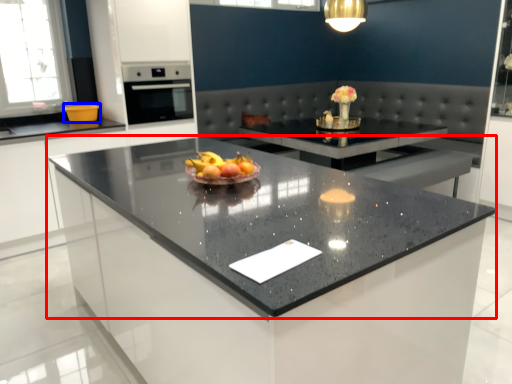
Question: Which object is closer to the camera taking this photo, countertop (highlighted by a red box) or kitchen appliance (highlighted by a blue box)?

Choices:
 (A) countertop
 (B) kitchen appliance

Answer: (A)